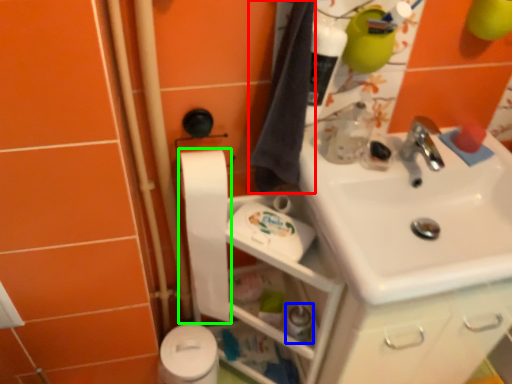
Question: Which object is the closest to the bath towel (highlighted by a red box)? Choose among these: toiletry (highlighted by a blue box) or toilet paper (highlighted by a green box).

Choices:
 (A) toiletry
 (B) toilet paper

Answer: (B)